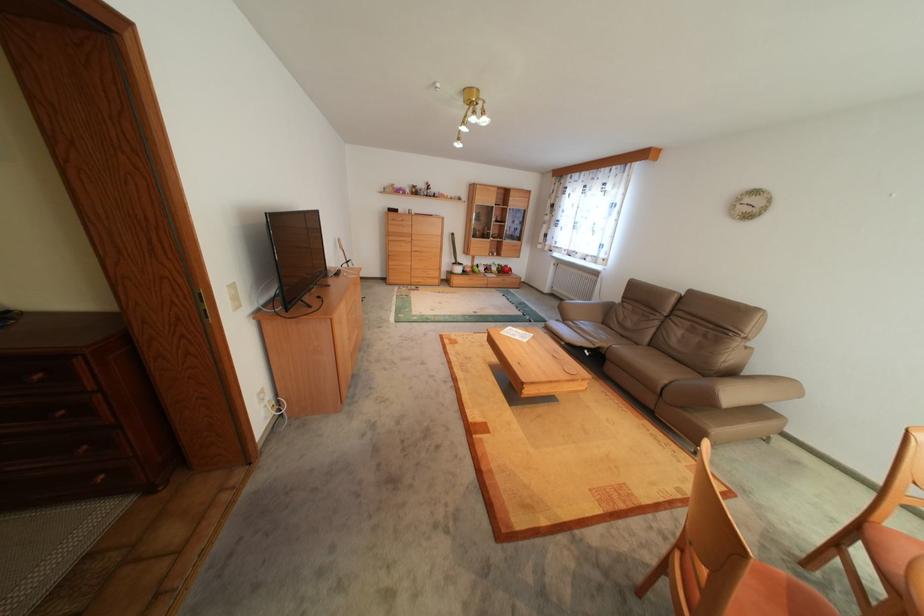
The image size is (924, 616). In order to click on brown sofa sitting surface in this screenshot , I will do `click(694, 338)`.